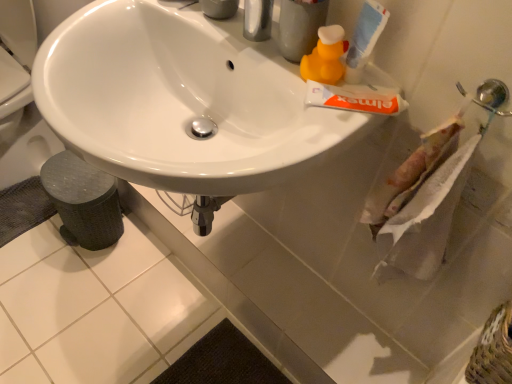
Locate an element on the screen. Image resolution: width=512 pixels, height=384 pixels. vacant space underneath gray textured bath mat at lower left (from a real-world perspective) is located at coordinates (28, 215).